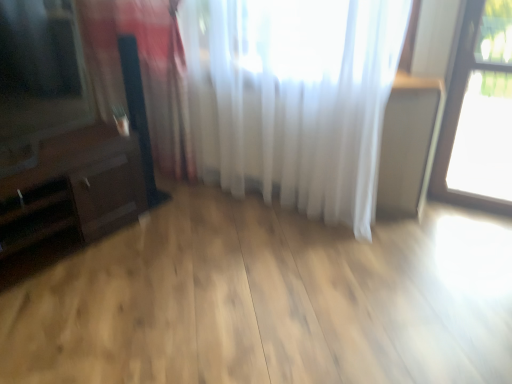
Question: From the image's perspective, is transparent glass window at upper right positioned above or below white sheer curtain at left, the 2th curtain in the right-to-left sequence?

Choices:
 (A) above
 (B) below

Answer: (A)

Question: Do you think transparent glass window at upper right is within white sheer curtain at left, which is the first curtain in left-to-right order, or outside of it?

Choices:
 (A) outside
 (B) inside

Answer: (A)

Question: Estimate the real-world distances between objects in this image. Which object is closer to the white sheer curtain at upper center, placed as the 1th curtain when sorted from right to left?

Choices:
 (A) dark brown wood dresser at left
 (B) matte black tv at left
 (C) white sheer curtain at left, which is the first curtain in left-to-right order
 (D) transparent glass window at upper right

Answer: (C)

Question: Estimate the real-world distances between objects in this image. Which object is closer to the transparent glass window at upper right?

Choices:
 (A) matte black tv at left
 (B) white sheer curtain at left, which is the first curtain in left-to-right order
 (C) dark brown wood dresser at left
 (D) white sheer curtain at upper center, the 2th curtain in the left-to-right sequence

Answer: (D)